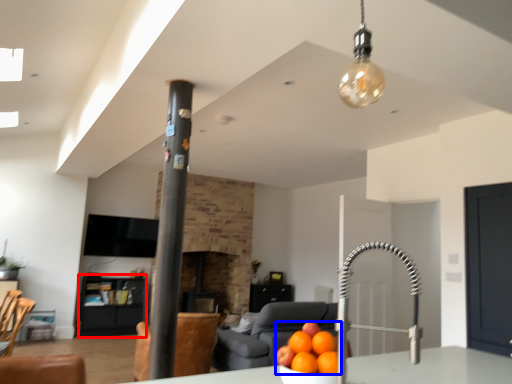
Question: Which of the following is the farthest to the observer, furniture (highlighted by a red box) or orange (highlighted by a blue box)?

Choices:
 (A) furniture
 (B) orange

Answer: (A)